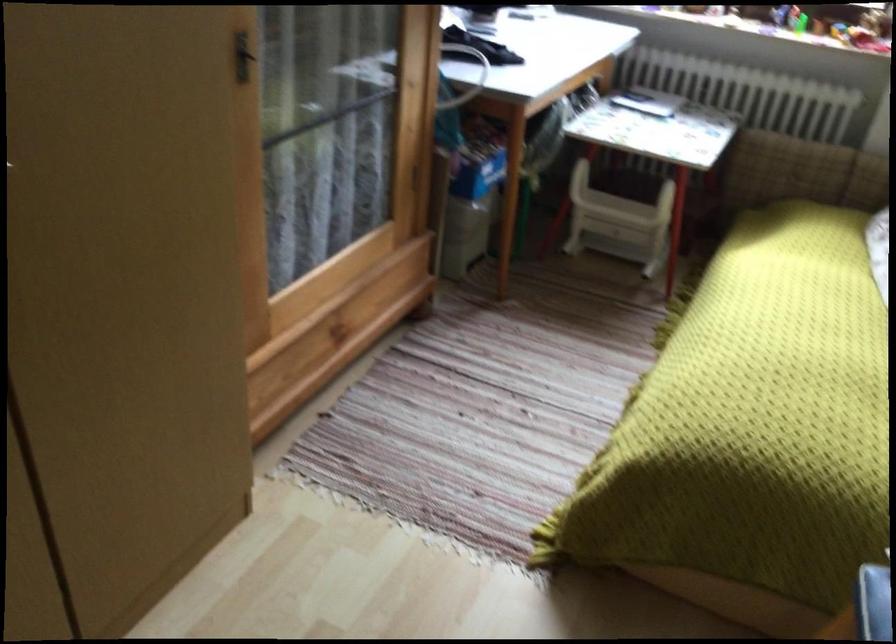
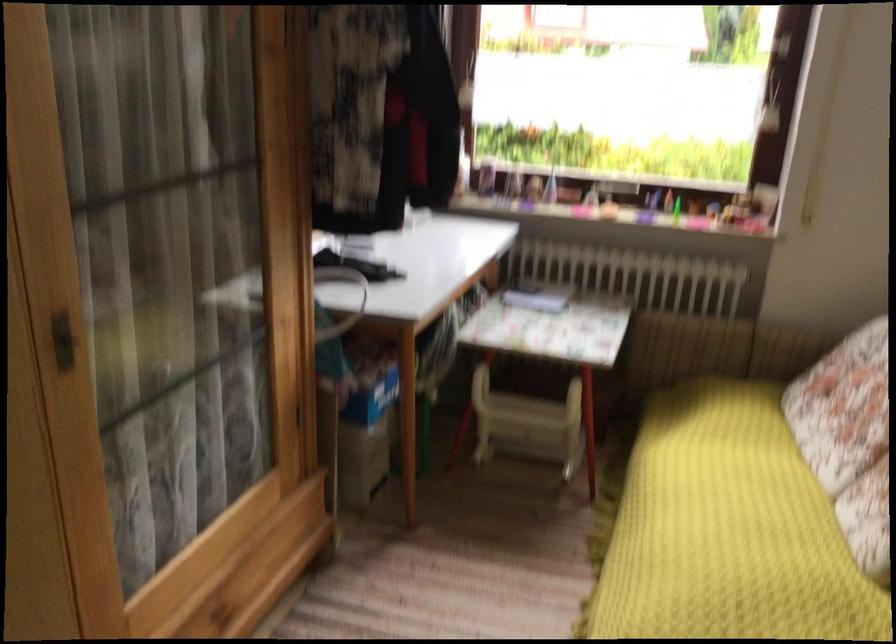
Where in the second image is the point corresponding to [470,158] from the first image?

(360, 381)